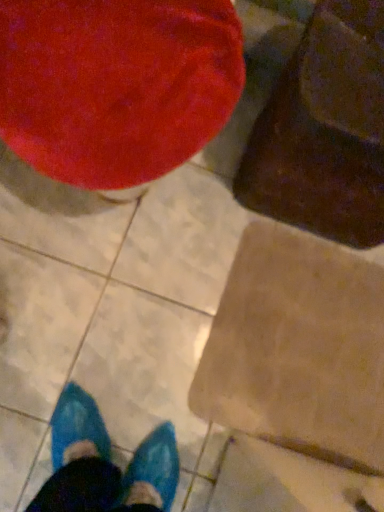
The image size is (384, 512). What do you see at coordinates (298, 349) in the screenshot?
I see `brown cardboard at lower right` at bounding box center [298, 349].

What are the coordinates of `brown cardboard at lower right` in the screenshot? It's located at (298, 349).

Does point (160, 60) appear closer or farther from the camera than point (326, 244)?

Point (160, 60) is positioned closer to the camera compared to point (326, 244).

Can you confirm if velvet red bean bag chair at upper left, the first bean bag chair viewed from the left, is thinner than brown cardboard at lower right?

In fact, velvet red bean bag chair at upper left, the first bean bag chair viewed from the left, might be wider than brown cardboard at lower right.

Is velvet red bean bag chair at upper left, acting as the second bean bag chair starting from the right, directly adjacent to brown cardboard at lower right?

No, velvet red bean bag chair at upper left, acting as the second bean bag chair starting from the right, is not with brown cardboard at lower right.

Is velvet red bean bag chair at upper left, acting as the second bean bag chair starting from the right, not inside brown cardboard at lower right?

That's correct, velvet red bean bag chair at upper left, acting as the second bean bag chair starting from the right, is outside of brown cardboard at lower right.

Is velvet red bean bag chair at upper left, acting as the second bean bag chair starting from the right, oriented away from velvety brown bean bag chair at upper right, placed as the 1th bean bag chair when sorted from right to left?

No, velvet red bean bag chair at upper left, acting as the second bean bag chair starting from the right, is not facing away from velvety brown bean bag chair at upper right, placed as the 1th bean bag chair when sorted from right to left.

Are velvet red bean bag chair at upper left, acting as the second bean bag chair starting from the right, and velvety brown bean bag chair at upper right, the second bean bag chair viewed from the left, far apart?

No, velvet red bean bag chair at upper left, acting as the second bean bag chair starting from the right, is not far away from velvety brown bean bag chair at upper right, the second bean bag chair viewed from the left.

Between velvet red bean bag chair at upper left, the first bean bag chair viewed from the left, and velvety brown bean bag chair at upper right, placed as the 1th bean bag chair when sorted from right to left, which one has larger width?

Wider between the two is velvet red bean bag chair at upper left, the first bean bag chair viewed from the left.

Is velvet red bean bag chair at upper left, acting as the second bean bag chair starting from the right, closer to camera compared to velvety brown bean bag chair at upper right, the second bean bag chair viewed from the left?

Yes, it is.

Would you say brown cardboard at lower right is inside or outside velvet red bean bag chair at upper left, the first bean bag chair viewed from the left?

brown cardboard at lower right cannot be found inside velvet red bean bag chair at upper left, the first bean bag chair viewed from the left.

Is brown cardboard at lower right oriented towards velvet red bean bag chair at upper left, the first bean bag chair viewed from the left?

No, brown cardboard at lower right is not turned towards velvet red bean bag chair at upper left, the first bean bag chair viewed from the left.

Which is more to the left, brown cardboard at lower right or velvet red bean bag chair at upper left, acting as the second bean bag chair starting from the right?

velvet red bean bag chair at upper left, acting as the second bean bag chair starting from the right.

From a real-world perspective, between brown cardboard at lower right and velvet red bean bag chair at upper left, acting as the second bean bag chair starting from the right, who is vertically lower?

brown cardboard at lower right is physically lower.

Measure the distance from velvety brown bean bag chair at upper right, placed as the 1th bean bag chair when sorted from right to left, to velvet red bean bag chair at upper left, the first bean bag chair viewed from the left.

11.01 inches.

Can you tell me how much velvety brown bean bag chair at upper right, placed as the 1th bean bag chair when sorted from right to left, and velvet red bean bag chair at upper left, acting as the second bean bag chair starting from the right, differ in facing direction?

The facing directions of velvety brown bean bag chair at upper right, placed as the 1th bean bag chair when sorted from right to left, and velvet red bean bag chair at upper left, acting as the second bean bag chair starting from the right, are 0.000227 degrees apart.

Is velvety brown bean bag chair at upper right, placed as the 1th bean bag chair when sorted from right to left, oriented away from velvet red bean bag chair at upper left, the first bean bag chair viewed from the left?

No, velvety brown bean bag chair at upper right, placed as the 1th bean bag chair when sorted from right to left, is not facing the opposite direction of velvet red bean bag chair at upper left, the first bean bag chair viewed from the left.

Looking at the image, does velvety brown bean bag chair at upper right, placed as the 1th bean bag chair when sorted from right to left, seem bigger or smaller compared to velvet red bean bag chair at upper left, the first bean bag chair viewed from the left?

In the image, velvety brown bean bag chair at upper right, placed as the 1th bean bag chair when sorted from right to left, appears to be smaller than velvet red bean bag chair at upper left, the first bean bag chair viewed from the left.

From the image's perspective, is velvety brown bean bag chair at upper right, the second bean bag chair viewed from the left, positioned above or below brown cardboard at lower right?

velvety brown bean bag chair at upper right, the second bean bag chair viewed from the left, is above brown cardboard at lower right.

Considering the sizes of velvety brown bean bag chair at upper right, the second bean bag chair viewed from the left, and brown cardboard at lower right in the image, is velvety brown bean bag chair at upper right, the second bean bag chair viewed from the left, wider or thinner than brown cardboard at lower right?

velvety brown bean bag chair at upper right, the second bean bag chair viewed from the left, is thinner than brown cardboard at lower right.

Is velvety brown bean bag chair at upper right, the second bean bag chair viewed from the left, looking in the opposite direction of brown cardboard at lower right?

No, velvety brown bean bag chair at upper right, the second bean bag chair viewed from the left, is not facing away from brown cardboard at lower right.

In the scene shown: Is velvety brown bean bag chair at upper right, placed as the 1th bean bag chair when sorted from right to left, to the left or to the right of brown cardboard at lower right in the image?

Based on their positions, velvety brown bean bag chair at upper right, placed as the 1th bean bag chair when sorted from right to left, is located to the right of brown cardboard at lower right.

Which object is closer to the camera, brown cardboard at lower right or velvety brown bean bag chair at upper right, the second bean bag chair viewed from the left?

velvety brown bean bag chair at upper right, the second bean bag chair viewed from the left, is more forward.

Considering the relative sizes of brown cardboard at lower right and velvety brown bean bag chair at upper right, placed as the 1th bean bag chair when sorted from right to left, in the image provided, is brown cardboard at lower right shorter than velvety brown bean bag chair at upper right, placed as the 1th bean bag chair when sorted from right to left,?

Correct, brown cardboard at lower right is not as tall as velvety brown bean bag chair at upper right, placed as the 1th bean bag chair when sorted from right to left.

Can you tell me how much brown cardboard at lower right and velvety brown bean bag chair at upper right, placed as the 1th bean bag chair when sorted from right to left, differ in facing direction?

The angular difference between brown cardboard at lower right and velvety brown bean bag chair at upper right, placed as the 1th bean bag chair when sorted from right to left, is 0.000148 degrees.

Would you say brown cardboard at lower right is outside velvety brown bean bag chair at upper right, the second bean bag chair viewed from the left?

brown cardboard at lower right lies outside velvety brown bean bag chair at upper right, the second bean bag chair viewed from the left,'s area.

Locate an element on the screen. cardboard box on the right of velvet red bean bag chair at upper left, the first bean bag chair viewed from the left is located at coordinates pyautogui.click(x=298, y=349).

Find the location of a particular element. This screenshot has width=384, height=512. bean bag chair above the velvety brown bean bag chair at upper right, placed as the 1th bean bag chair when sorted from right to left (from a real-world perspective) is located at coordinates (116, 85).

Estimate the real-world distances between objects in this image. Which object is further from velvet red bean bag chair at upper left, the first bean bag chair viewed from the left, velvety brown bean bag chair at upper right, placed as the 1th bean bag chair when sorted from right to left, or brown cardboard at lower right?

brown cardboard at lower right is positioned further to the anchor velvet red bean bag chair at upper left, the first bean bag chair viewed from the left.

When comparing their distances from velvety brown bean bag chair at upper right, the second bean bag chair viewed from the left, does brown cardboard at lower right or velvet red bean bag chair at upper left, acting as the second bean bag chair starting from the right, seem closer?

velvet red bean bag chair at upper left, acting as the second bean bag chair starting from the right, is closer to velvety brown bean bag chair at upper right, the second bean bag chair viewed from the left.

From the image, which object appears to be farther from velvety brown bean bag chair at upper right, placed as the 1th bean bag chair when sorted from right to left, velvet red bean bag chair at upper left, acting as the second bean bag chair starting from the right, or brown cardboard at lower right?

brown cardboard at lower right is further to velvety brown bean bag chair at upper right, placed as the 1th bean bag chair when sorted from right to left.

Considering their positions, is brown cardboard at lower right positioned closer to velvet red bean bag chair at upper left, acting as the second bean bag chair starting from the right, than velvety brown bean bag chair at upper right, placed as the 1th bean bag chair when sorted from right to left?

Among the two, velvety brown bean bag chair at upper right, placed as the 1th bean bag chair when sorted from right to left, is located nearer to velvet red bean bag chair at upper left, acting as the second bean bag chair starting from the right.

From the image, which object appears to be nearer to brown cardboard at lower right, velvety brown bean bag chair at upper right, placed as the 1th bean bag chair when sorted from right to left, or velvet red bean bag chair at upper left, the first bean bag chair viewed from the left?

velvety brown bean bag chair at upper right, placed as the 1th bean bag chair when sorted from right to left, lies closer to brown cardboard at lower right than the other object.

Looking at the image, which one is located further to brown cardboard at lower right, velvet red bean bag chair at upper left, the first bean bag chair viewed from the left, or velvety brown bean bag chair at upper right, placed as the 1th bean bag chair when sorted from right to left?

The object further to brown cardboard at lower right is velvet red bean bag chair at upper left, the first bean bag chair viewed from the left.

The height and width of the screenshot is (512, 384). Identify the location of bean bag chair positioned between velvet red bean bag chair at upper left, the first bean bag chair viewed from the left, and brown cardboard at lower right from near to far. (324, 130).